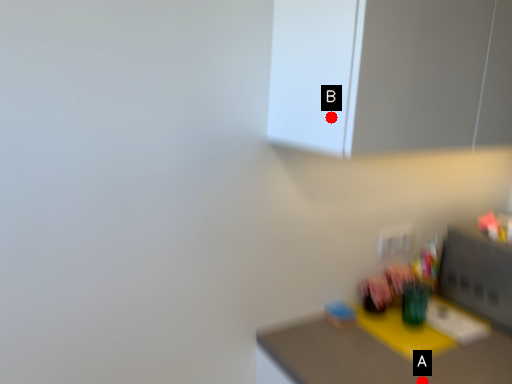
Question: Two points are circled on the image, labeled by A and B beside each circle. Which point is closer to the camera?

Choices:
 (A) A is closer
 (B) B is closer

Answer: (B)